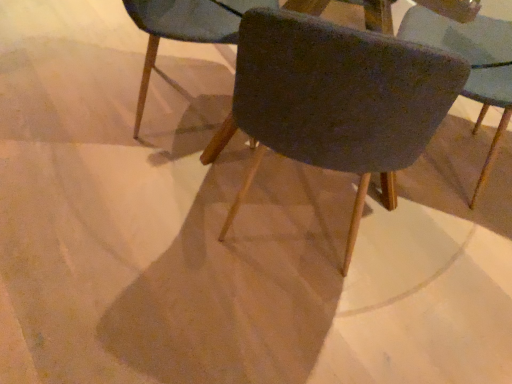
The image size is (512, 384). In order to click on vacant space in front of velvet dark blue chair at center, placed as the 2th chair when sorted from left to right in this screenshot , I will do `click(266, 324)`.